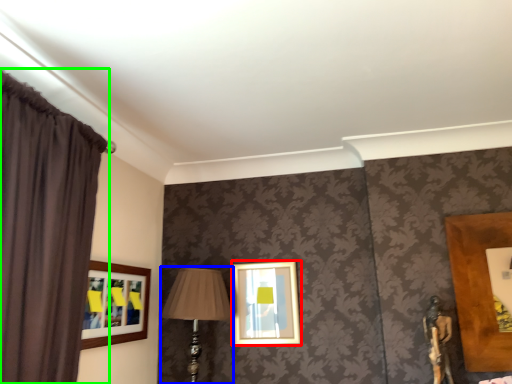
Question: Considering the real-world distances, which object is closest to picture frame (highlighted by a red box)? table lamp (highlighted by a blue box) or curtain (highlighted by a green box).

Choices:
 (A) table lamp
 (B) curtain

Answer: (A)